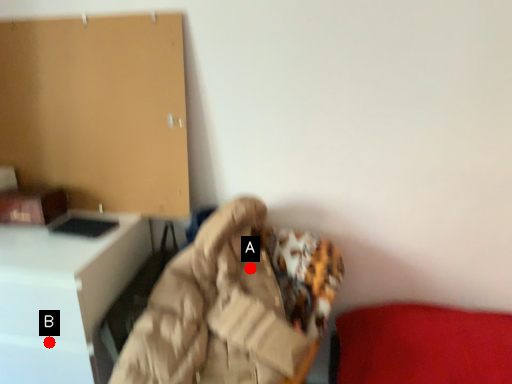
Question: Two points are circled on the image, labeled by A and B beside each circle. Which point is closer to the camera?

Choices:
 (A) A is closer
 (B) B is closer

Answer: (B)